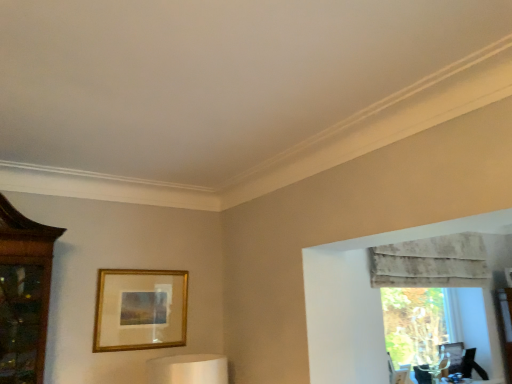
Question: Considering the relative sizes of gold metallic picture frame at center and textured beige curtain at upper right in the image provided, is gold metallic picture frame at center smaller than textured beige curtain at upper right?

Choices:
 (A) yes
 (B) no

Answer: (A)

Question: Is gold metallic picture frame at center not close to textured beige curtain at upper right?

Choices:
 (A) yes
 (B) no

Answer: (A)

Question: Is gold metallic picture frame at center to the right of textured beige curtain at upper right from the viewer's perspective?

Choices:
 (A) yes
 (B) no

Answer: (B)

Question: From a real-world perspective, is gold metallic picture frame at center located higher than textured beige curtain at upper right?

Choices:
 (A) no
 (B) yes

Answer: (A)

Question: Is gold metallic picture frame at center wider than textured beige curtain at upper right?

Choices:
 (A) yes
 (B) no

Answer: (B)

Question: Looking at the image, does textured beige curtain at upper right seem bigger or smaller compared to transparent glass vase at right?

Choices:
 (A) big
 (B) small

Answer: (A)

Question: Is textured beige curtain at upper right wider or thinner than transparent glass vase at right?

Choices:
 (A) wide
 (B) thin

Answer: (A)

Question: Is point (432, 284) positioned closer to the camera than point (439, 316)?

Choices:
 (A) closer
 (B) farther

Answer: (A)

Question: Considering their positions, is textured beige curtain at upper right located in front of or behind transparent glass vase at right?

Choices:
 (A) behind
 (B) front

Answer: (B)

Question: Considering the positions of point (113, 321) and point (418, 279), is point (113, 321) closer or farther from the camera than point (418, 279)?

Choices:
 (A) closer
 (B) farther

Answer: (A)

Question: From the image's perspective, relative to textured beige curtain at upper right, is gold metallic picture frame at center above or below?

Choices:
 (A) above
 (B) below

Answer: (B)

Question: Considering their positions, is gold metallic picture frame at center located in front of or behind textured beige curtain at upper right?

Choices:
 (A) front
 (B) behind

Answer: (A)

Question: In the image, is gold metallic picture frame at center on the left side or the right side of textured beige curtain at upper right?

Choices:
 (A) right
 (B) left

Answer: (B)

Question: Considering the positions of gold metallic picture frame at center and transparent glass vase at right in the image, is gold metallic picture frame at center taller or shorter than transparent glass vase at right?

Choices:
 (A) tall
 (B) short

Answer: (B)

Question: Is gold metallic picture frame at center inside the boundaries of transparent glass vase at right, or outside?

Choices:
 (A) inside
 (B) outside

Answer: (B)